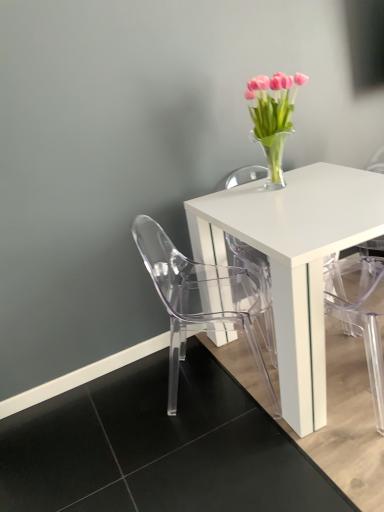
Where is `vacant position to the left of white glossy table at center`? vacant position to the left of white glossy table at center is located at coordinates (158, 412).